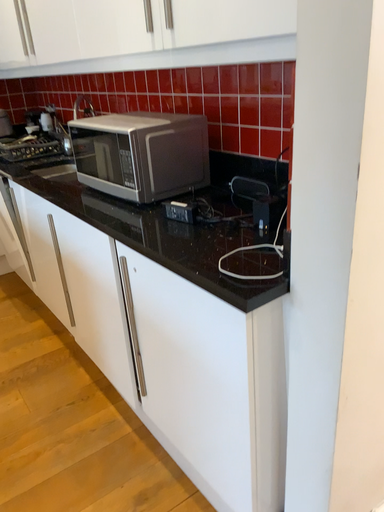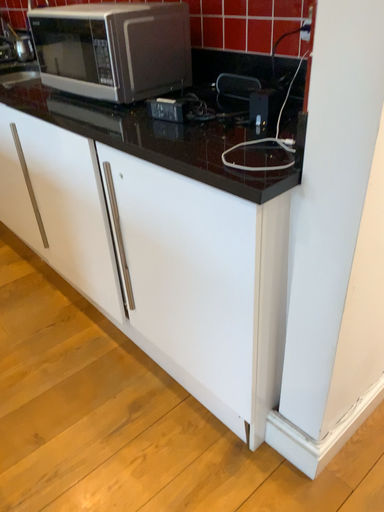
Question: Which way did the camera rotate in the video?

Choices:
 (A) rotated downward
 (B) rotated upward

Answer: (A)